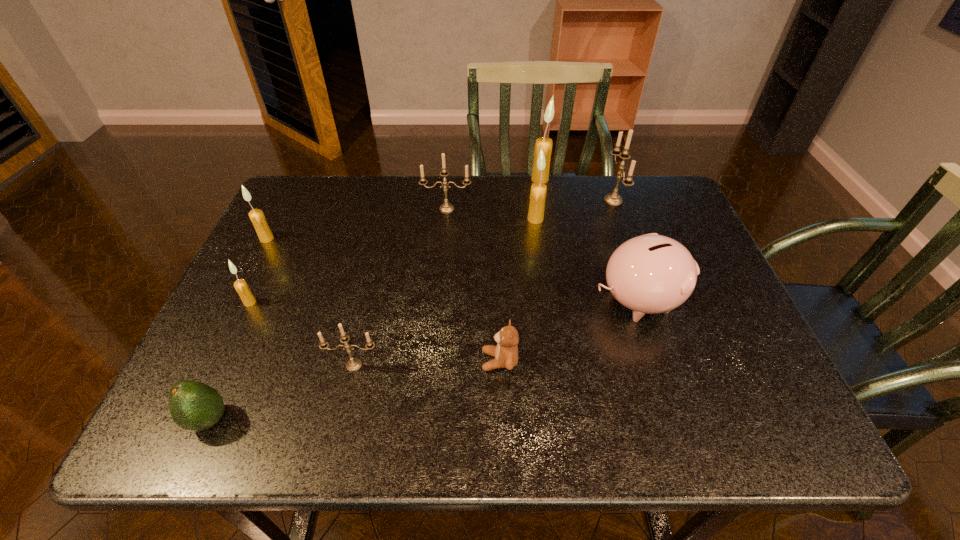
Where is `the second nearest candle`? the second nearest candle is located at coordinates (240, 285).

This screenshot has height=540, width=960. Identify the location of the nearest cream candle. (240, 285).

The height and width of the screenshot is (540, 960). Find the location of `the smallest metallic candle`. the smallest metallic candle is located at coordinates (353, 364).

Identify the location of the nearest metallic candle. (353, 364).

Where is `teddy bear`? teddy bear is located at coordinates (506, 352).

Locate an element on the screen. This screenshot has width=960, height=540. avocado is located at coordinates (194, 406).

Image resolution: width=960 pixels, height=540 pixels. Identify the location of the nearest object. (194, 406).

I want to click on vacant region located 0.380m on the right of the biggest cream candle, so click(669, 179).

This screenshot has height=540, width=960. What are the coordinates of `vacant space located 0.320m on the front of the rightmost candle` in the screenshot? It's located at (650, 305).

Find the location of a particular element. vacant area located 0.140m on the right of the third smallest cream candle is located at coordinates (592, 219).